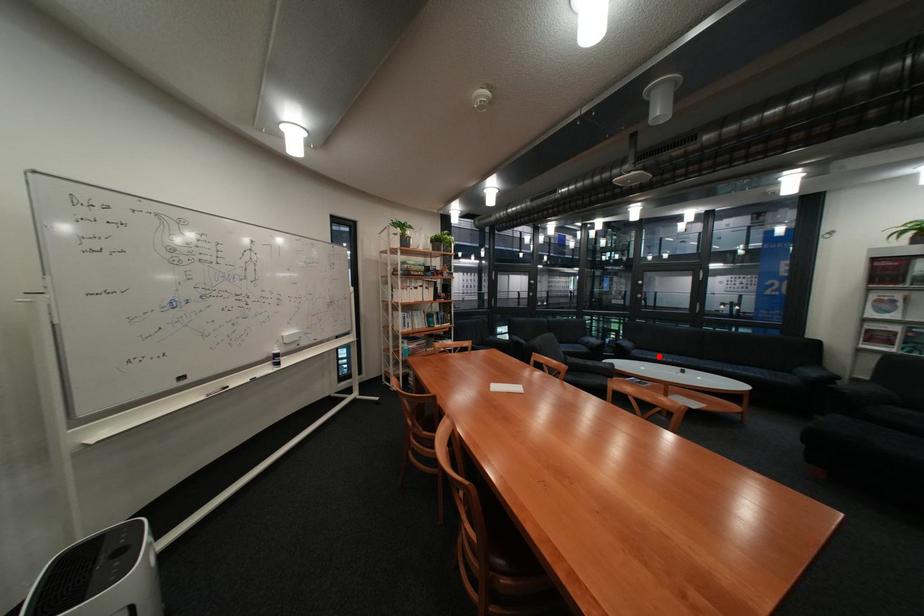
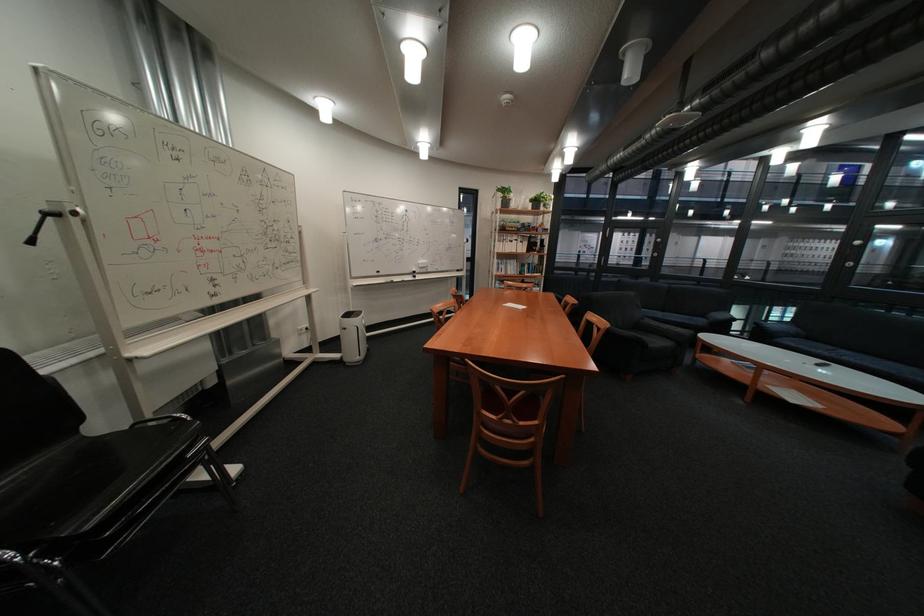
In the second image, find the point that corresponds to the highlighted location in the first image.

(808, 345)